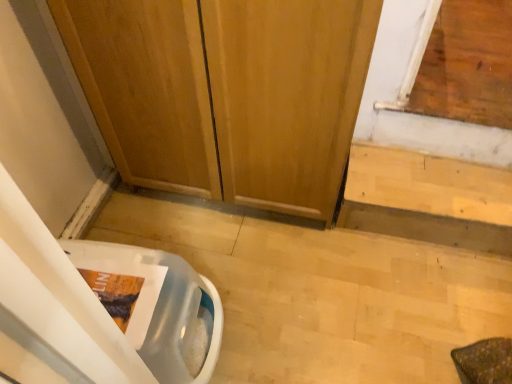
At what (x,y) coordinates should I click in order to perform the action: click on empty space that is ontop of light wood stairs at lower right (from a real-world perspective). Please return your answer as a coordinate pair (x, y). This screenshot has width=512, height=384. Looking at the image, I should click on (438, 185).